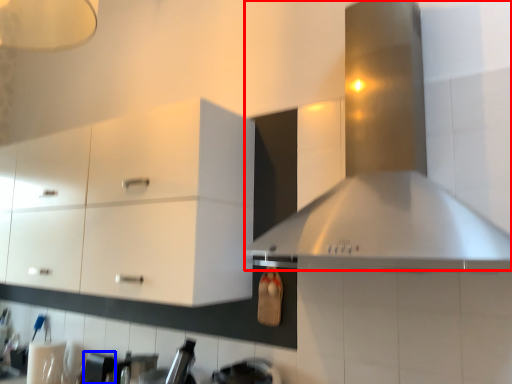
Question: Which of the following is the farthest to the observer, vent (highlighted by a red box) or appliance (highlighted by a blue box)?

Choices:
 (A) vent
 (B) appliance

Answer: (B)